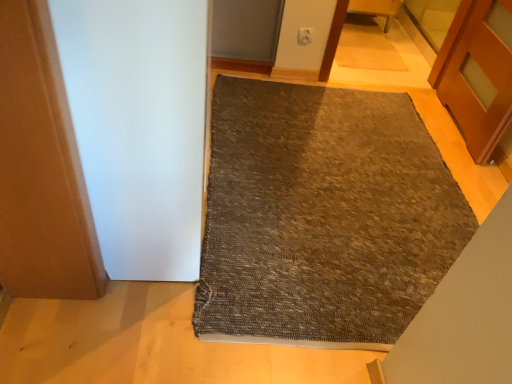
I want to click on empty space that is ontop of textured gray mat at center (from a real-world perspective), so click(302, 182).